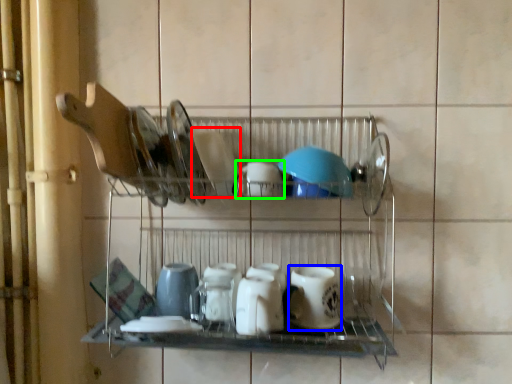
Question: Which is nearer to the tableware (highlighted by a red box)? tableware (highlighted by a blue box) or tableware (highlighted by a green box).

Choices:
 (A) tableware
 (B) tableware

Answer: (B)